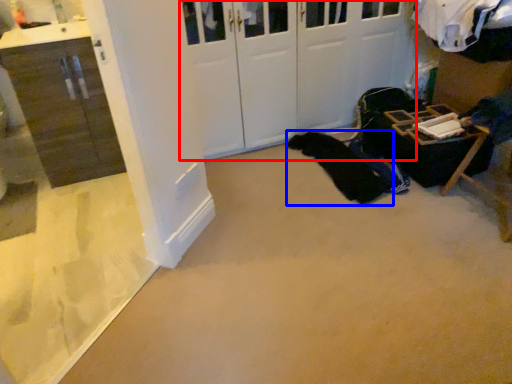
Question: Which of the following is the closest to the observer, door (highlighted by a red box) or clothing (highlighted by a blue box)?

Choices:
 (A) door
 (B) clothing

Answer: (A)